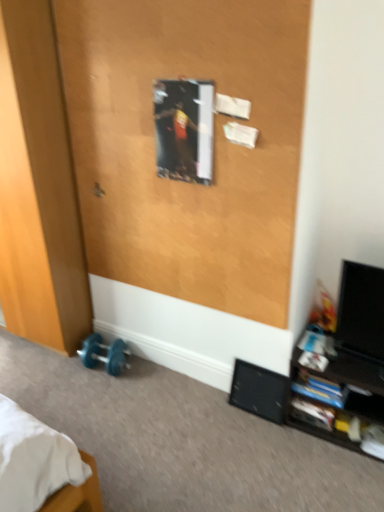
Question: Is black glossy monitor at right bigger or smaller than black glossy shelf at lower right?

Choices:
 (A) big
 (B) small

Answer: (B)

Question: From the image's perspective, is black glossy monitor at right above or below black glossy shelf at lower right?

Choices:
 (A) above
 (B) below

Answer: (A)

Question: Considering the real-world distances, which object is closest to the black glossy monitor at right?

Choices:
 (A) wooden door at lower left, the 1th screen door positioned from the left
 (B) wooden poster at upper center, arranged as the second screen door when viewed from the left
 (C) blue rubber dumbbell at lower left
 (D) black glossy shelf at lower right
 (E) metallic silver door handle at upper center

Answer: (D)

Question: Which of these objects is positioned farthest from the black matte speaker at lower right?

Choices:
 (A) metallic silver door handle at upper center
 (B) black glossy shelf at lower right
 (C) wooden poster at upper center, which is counted as the 1th screen door, starting from the right
 (D) blue rubber dumbbell at lower left
 (E) black glossy monitor at right

Answer: (A)